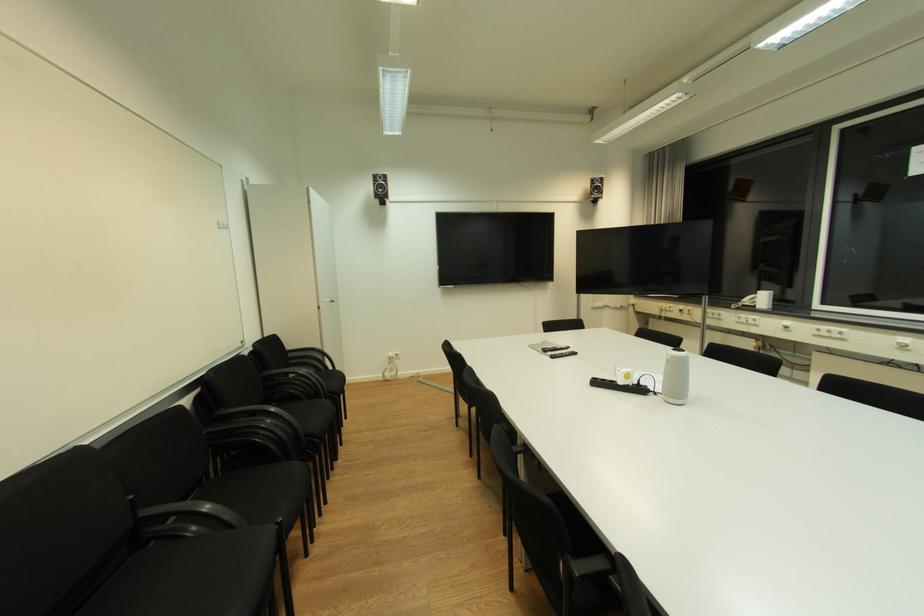
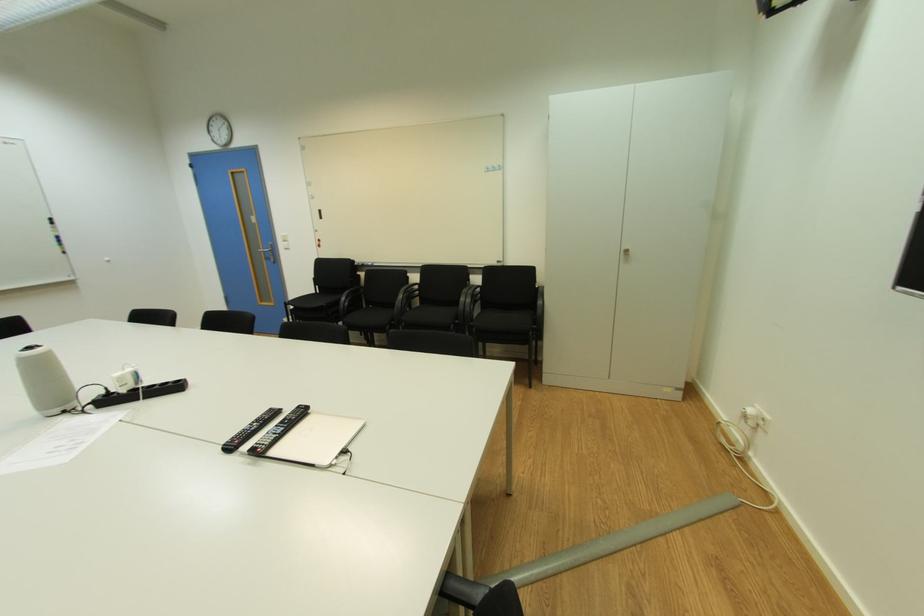
In the second image, find the point that corresponds to (x=335, y=304) in the first image.

(628, 254)